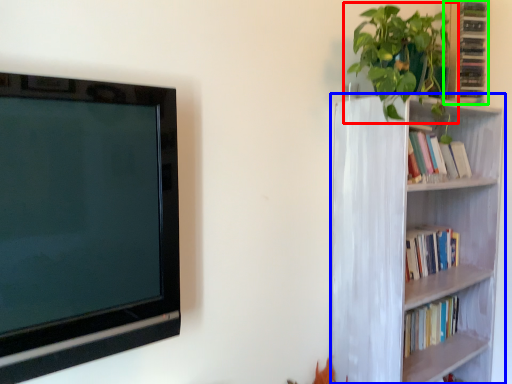
Question: Considering the real-world distances, which object is closest to houseplant (highlighted by a red box)? bookcase (highlighted by a blue box) or cabinet (highlighted by a green box).

Choices:
 (A) bookcase
 (B) cabinet

Answer: (B)